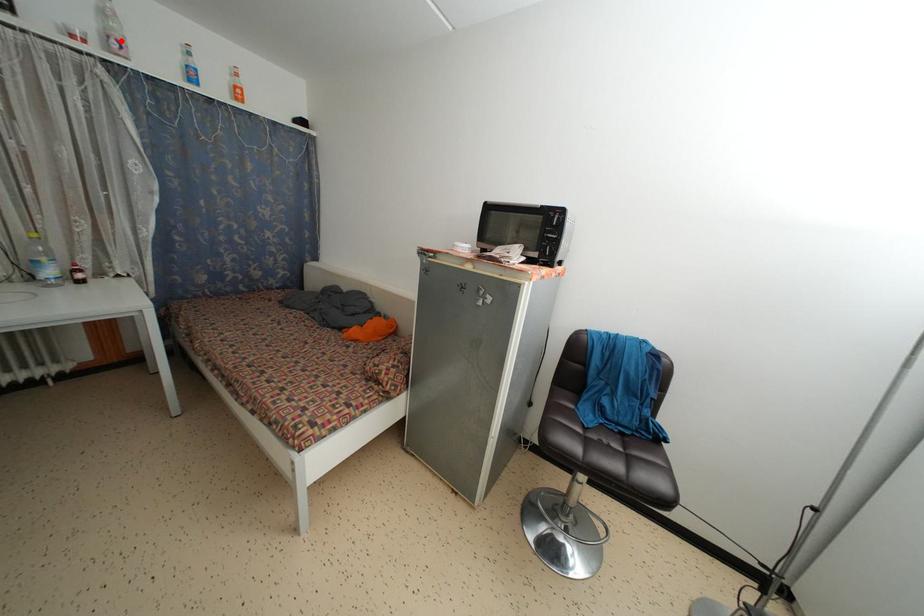
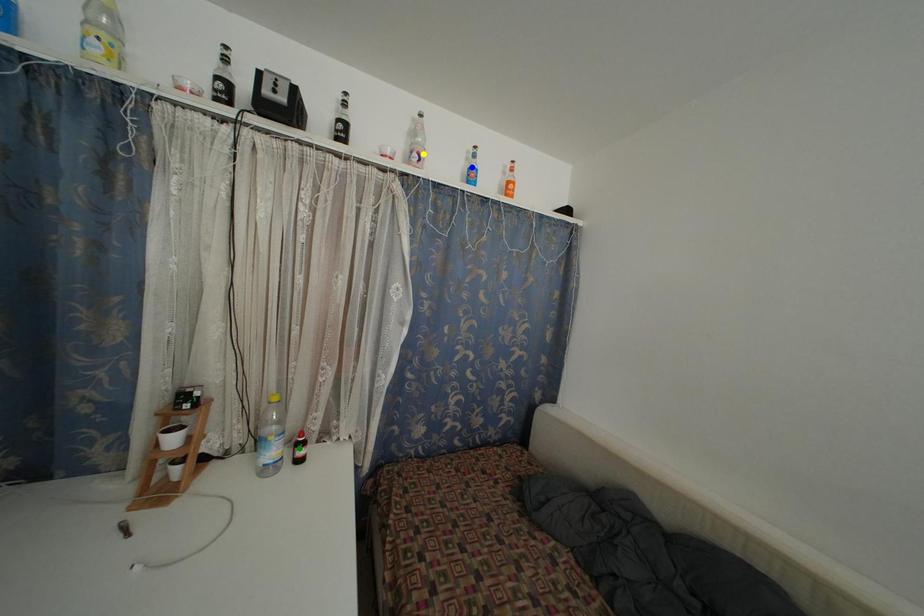
Question: I am providing you with two images of the same scene from different viewpoints. A red point is marked on the first image. You are given multiple points on the second image. Which spot in image 2 lines up with the point in image 1?

Choices:
 (A) blue point
 (B) yellow point
 (C) green point

Answer: (B)